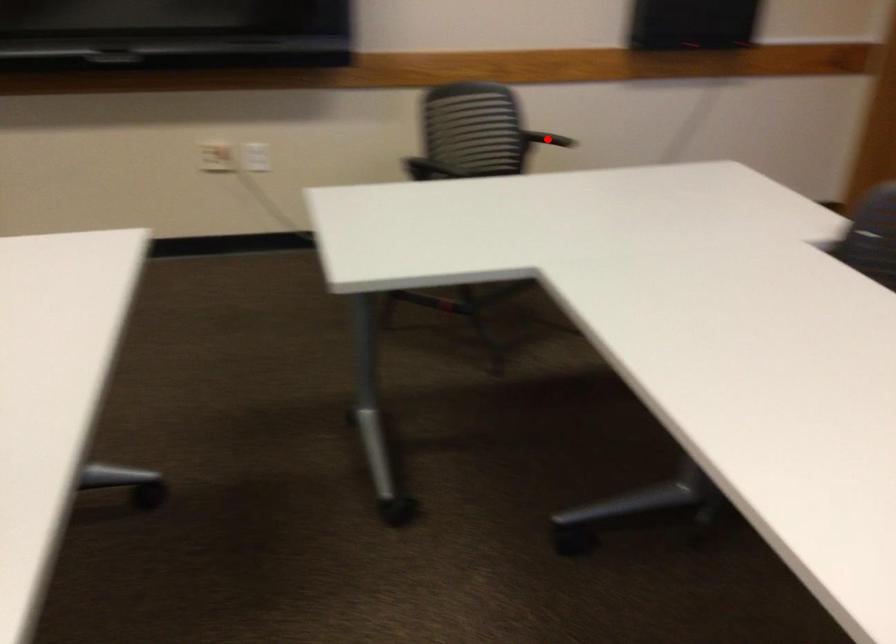
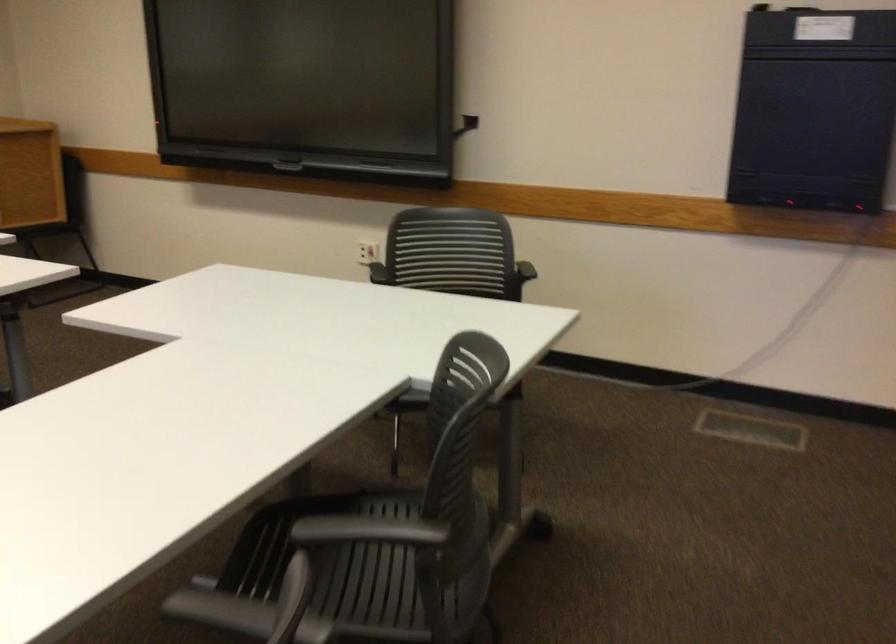
Question: I am providing you with two images of the same scene from different viewpoints. A red point is marked on the first image. Is the red point's position out of view in image 2?

Choices:
 (A) Yes
 (B) No

Answer: (A)